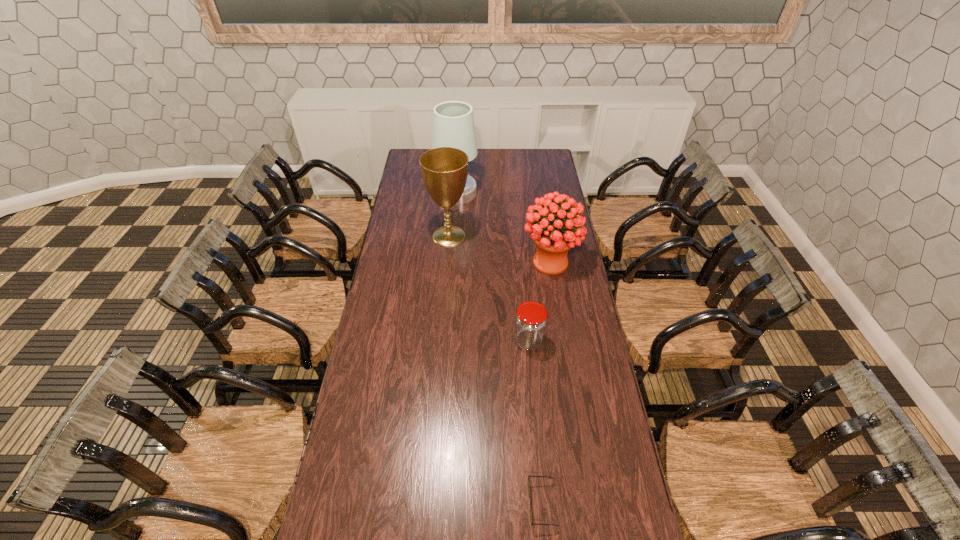
Where is `the farthest object`? Image resolution: width=960 pixels, height=540 pixels. the farthest object is located at coordinates point(453,124).

Find the location of a particular element. This screenshot has width=960, height=540. trophy cup is located at coordinates (444, 170).

Locate an element on the screen. Image resolution: width=960 pixels, height=540 pixels. bouquet is located at coordinates (553, 235).

Find the location of a particular element. the fourth tallest object is located at coordinates (531, 320).

Find the location of a particular element. the second nearest object is located at coordinates (531, 320).

Where is `the nearest object`? This screenshot has width=960, height=540. the nearest object is located at coordinates (529, 490).

The height and width of the screenshot is (540, 960). What are the coordinates of `the shortest object` in the screenshot? It's located at (529, 490).

Where is `vacant space situated 0.230m on the base of the lampshade`? The image size is (960, 540). vacant space situated 0.230m on the base of the lampshade is located at coordinates (519, 193).

What are the coordinates of `vacant region located on the back of the trophy cup` in the screenshot? It's located at (452, 191).

You are a GUI agent. You are given a task and a screenshot of the screen. Output one action in this format:
    pyautogui.click(x=<x>, y=<y>)
    Task: Click on the vacant region located on the front of the bouquet
    This screenshot has width=960, height=540.
    Given the screenshot: What is the action you would take?
    pyautogui.click(x=560, y=321)